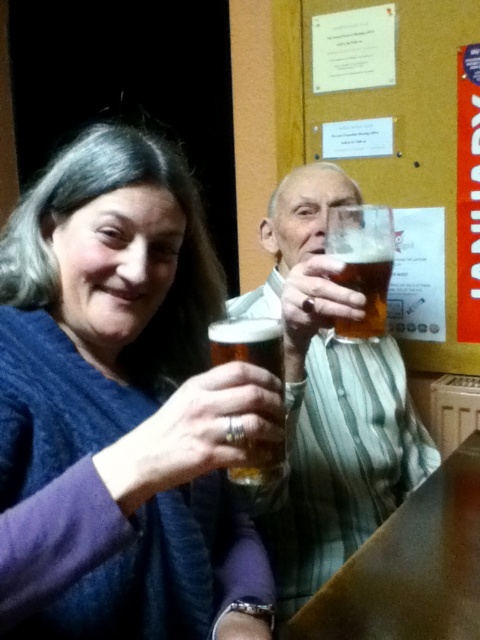
Question: Does matte blue sweater at upper left have a smaller size compared to translucent glass beer at center?

Choices:
 (A) yes
 (B) no

Answer: (B)

Question: Which point appears closest to the camera in this image?

Choices:
 (A) (295, 177)
 (B) (132, 195)
 (C) (363, 330)
 (D) (273, 474)

Answer: (D)

Question: Which object appears farthest from the camera in this image?

Choices:
 (A) translucent glass at upper center
 (B) translucent glass beer at center
 (C) matte blue sweater at upper left

Answer: (A)

Question: Which point is farther to the camera?

Choices:
 (A) (229, 477)
 (B) (152, 152)
 (C) (287, 294)

Answer: (C)

Question: Can you confirm if matte blue sweater at upper left is positioned below translucent glass at upper center?

Choices:
 (A) no
 (B) yes

Answer: (B)

Question: Where is matte blue sweater at upper left located in relation to translucent glass at upper center in the image?

Choices:
 (A) right
 (B) left

Answer: (B)